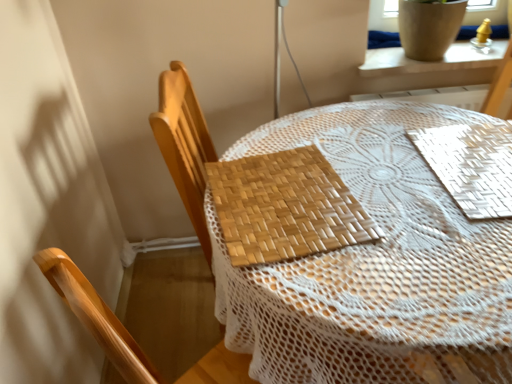
Find the location of a particular element. This screenshot has height=384, width=512. vacant space that is to the left of white woven mat at upper right, arranged as the first mat when viewed from the right is located at coordinates (381, 174).